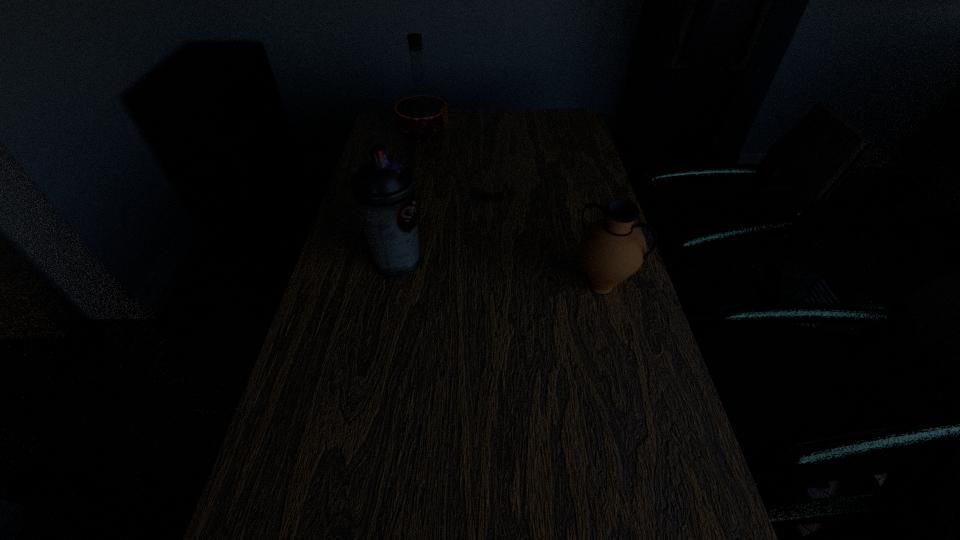
The width and height of the screenshot is (960, 540). I want to click on liquor, so click(421, 113).

Where is `aerosol can`? aerosol can is located at coordinates (384, 189).

The width and height of the screenshot is (960, 540). Find the location of `the rightmost object`. the rightmost object is located at coordinates [612, 248].

I want to click on pitcher, so pyautogui.click(x=612, y=248).

Find the location of `the second farthest object`. the second farthest object is located at coordinates (498, 196).

At what (x,y) coordinates should I click in order to perform the action: click on the shortest object. Please return your answer as a coordinate pair (x, y). The height and width of the screenshot is (540, 960). Looking at the image, I should click on click(498, 196).

Image resolution: width=960 pixels, height=540 pixels. I want to click on vacant region located 0.390m on the front label of the liquor, so click(x=556, y=134).

Where is `free spot located on the front of the aerosol can`? The height and width of the screenshot is (540, 960). free spot located on the front of the aerosol can is located at coordinates (389, 312).

Locate an element on the screen. This screenshot has width=960, height=540. free space located on the front of the third tallest object is located at coordinates click(x=637, y=425).

Identify the location of free location located 0.360m on the surface of the cherry. This screenshot has height=540, width=960. (495, 294).